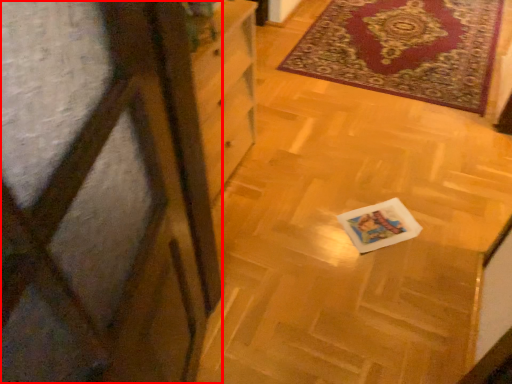
Question: Where is screen door (annotated by the red box) located in relation to mat in the image?

Choices:
 (A) right
 (B) left

Answer: (B)